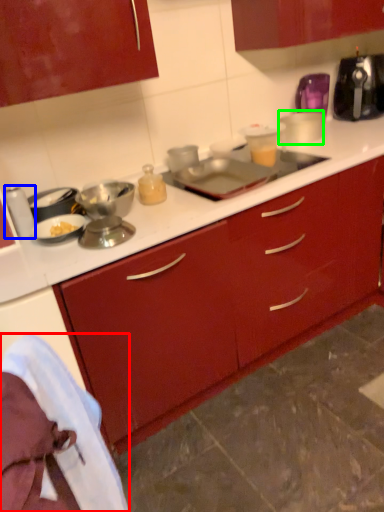
Question: Which is farther away from material (highlighted by a red box)? appliance (highlighted by a blue box) or appliance (highlighted by a green box)?

Choices:
 (A) appliance
 (B) appliance

Answer: (B)